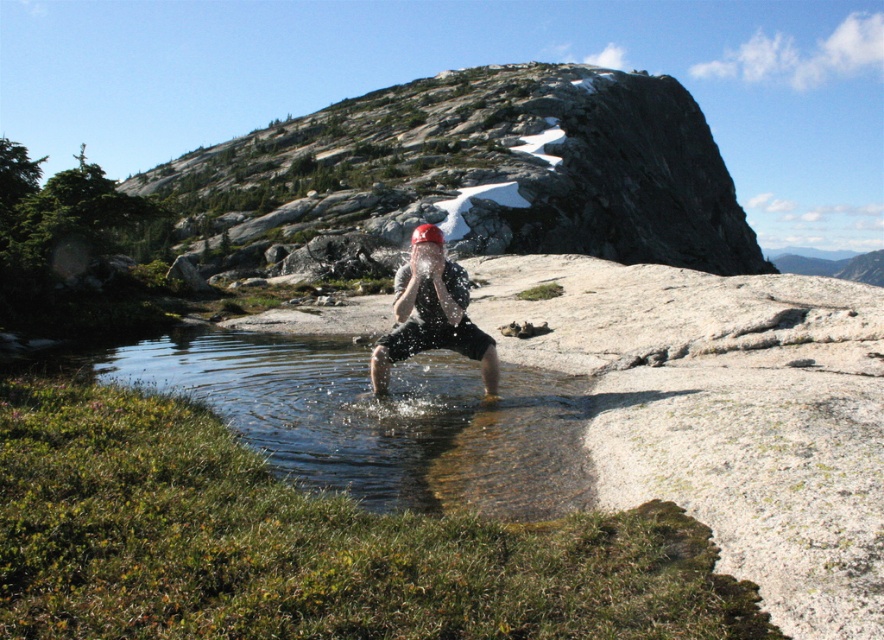
Who is taller, clear water at center or matte black helmet at center?

matte black helmet at center

Who is more distant from viewer, (583, 492) or (470, 342)?

Positioned behind is point (470, 342).

Find the location of a particular element. The height and width of the screenshot is (640, 884). clear water at center is located at coordinates (380, 419).